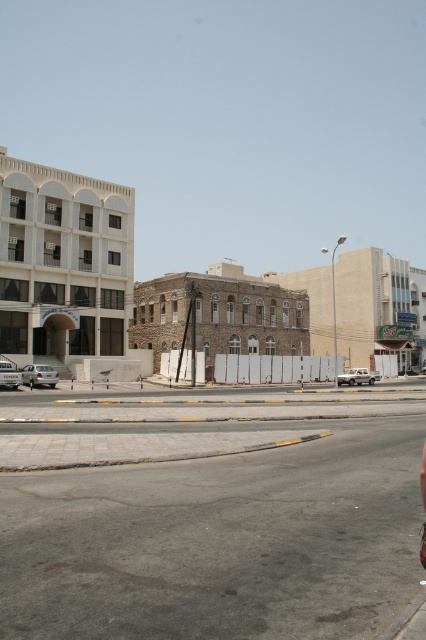
Question: Which point appears farthest from the camera in this image?

Choices:
 (A) (180, 314)
 (B) (382, 280)

Answer: (B)

Question: Does brown stone building at center have a larger size compared to beige stone building at center?

Choices:
 (A) yes
 (B) no

Answer: (B)

Question: Based on their relative distances, which object is farther from the white matte building at upper left?

Choices:
 (A) beige stone building at center
 (B) brown stone building at center

Answer: (A)

Question: In this image, where is brown stone building at center located relative to beige stone building at center?

Choices:
 (A) left
 (B) right

Answer: (A)

Question: Is white matte building at upper left positioned in front of beige stone building at center?

Choices:
 (A) no
 (B) yes

Answer: (B)

Question: Which point appears farthest from the camera in this image?

Choices:
 (A) (348, 356)
 (B) (63, 337)

Answer: (A)